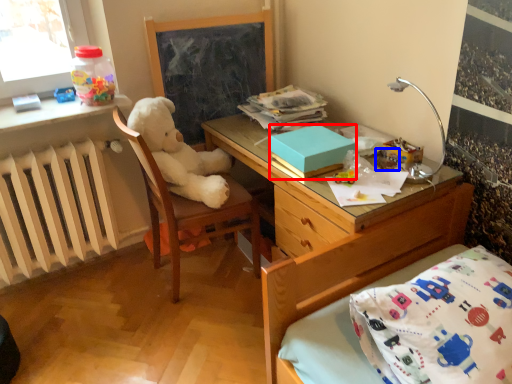
Question: Which object appears farthest to the camera in this image, box (highlighted by a red box) or toy (highlighted by a blue box)?

Choices:
 (A) box
 (B) toy

Answer: (B)